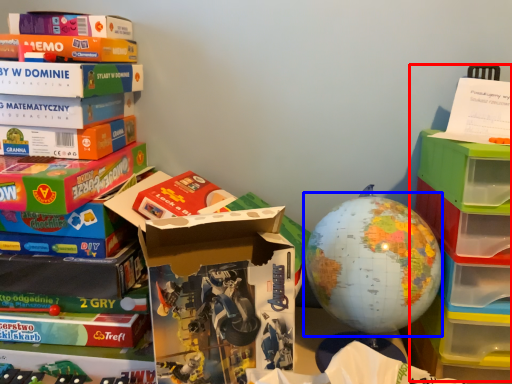
Question: Which point is further to the camera, shelf (highlighted by a red box) or earth (highlighted by a blue box)?

Choices:
 (A) shelf
 (B) earth

Answer: (B)